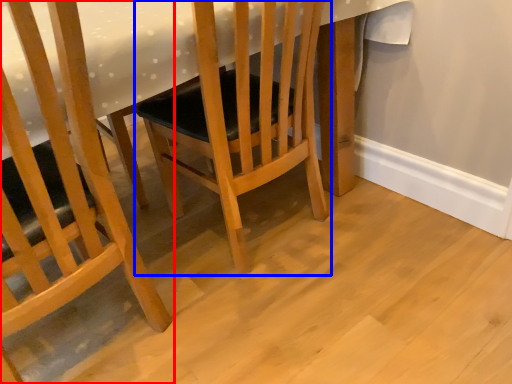
Question: Which object is further to the camera taking this photo, chair (highlighted by a red box) or chair (highlighted by a blue box)?

Choices:
 (A) chair
 (B) chair

Answer: (B)